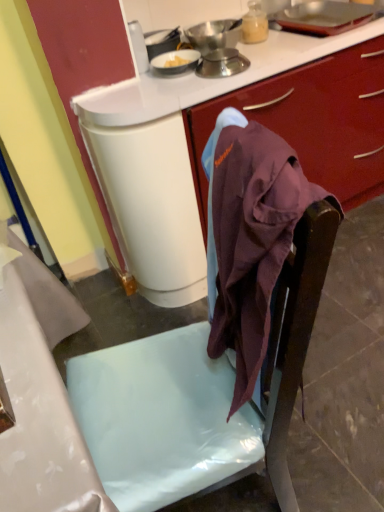
Measure the distance between matte plastic chair at center and camera.

A distance of 22.28 inches exists between matte plastic chair at center and camera.

Image resolution: width=384 pixels, height=512 pixels. Describe the element at coordinates (214, 35) in the screenshot. I see `metallic silver bowl at upper center, which is counted as the first kitchen appliance, starting from the top` at that location.

Identify the location of purple fabric at center. The image size is (384, 512). (172, 159).

Considering the relative sizes of metallic silver scale at upper center, the first kitchen appliance from the bottom, and matte plastic chair at center in the image provided, is metallic silver scale at upper center, the first kitchen appliance from the bottom, smaller than matte plastic chair at center?

Yes.

Which is in front, metallic silver scale at upper center, placed as the 2th kitchen appliance when sorted from top to bottom, or matte plastic chair at center?

matte plastic chair at center is closer to the camera.

In terms of height, does metallic silver scale at upper center, the first kitchen appliance from the bottom, look taller or shorter compared to matte plastic chair at center?

Considering their sizes, metallic silver scale at upper center, the first kitchen appliance from the bottom, has more height than matte plastic chair at center.

Between metallic silver bowl at upper center, which is counted as the first kitchen appliance, starting from the top, and matte plastic chair at center, which one has smaller size?

metallic silver bowl at upper center, which is counted as the first kitchen appliance, starting from the top.

How much distance is there between metallic silver bowl at upper center, which is counted as the first kitchen appliance, starting from the top, and matte plastic chair at center?

They are 3.78 feet apart.

Is metallic silver bowl at upper center, the second kitchen appliance positioned from the bottom, spatially inside matte plastic chair at center, or outside of it?

metallic silver bowl at upper center, the second kitchen appliance positioned from the bottom, is spatially situated outside matte plastic chair at center.

Can you confirm if metallic silver bowl at upper center, which is counted as the first kitchen appliance, starting from the top, is positioned to the right of matte plastic chair at center?

In fact, metallic silver bowl at upper center, which is counted as the first kitchen appliance, starting from the top, is to the left of matte plastic chair at center.

Considering the positions of points (170, 348) and (131, 184), is point (170, 348) closer to camera compared to point (131, 184)?

Yes, point (170, 348) is in front of point (131, 184).

Does matte plastic chair at center appear on the left side of purple fabric at center?

Yes, matte plastic chair at center is to the left of purple fabric at center.

Is matte plastic chair at center not close to purple fabric at center?

matte plastic chair at center is actually quite close to purple fabric at center.

From a real-world perspective, is matte plastic chair at center under metallic silver bowl at upper center, the second kitchen appliance positioned from the bottom?

Correct, in the physical world, matte plastic chair at center is lower than metallic silver bowl at upper center, the second kitchen appliance positioned from the bottom.

From the image's perspective, who appears lower, matte plastic chair at center or metallic silver bowl at upper center, the second kitchen appliance positioned from the bottom?

matte plastic chair at center is shown below in the image.

Identify the location of chair below the metallic silver bowl at upper center, the second kitchen appliance positioned from the bottom (from a real-world perspective). (199, 396).

In the scene shown: Does matte plastic chair at center touch metallic silver bowl at upper center, which is counted as the first kitchen appliance, starting from the top?

There is a gap between matte plastic chair at center and metallic silver bowl at upper center, which is counted as the first kitchen appliance, starting from the top.

Which of these two, matte plastic chair at center or metallic silver scale at upper center, placed as the 2th kitchen appliance when sorted from top to bottom, is smaller?

metallic silver scale at upper center, placed as the 2th kitchen appliance when sorted from top to bottom, is smaller.

The width and height of the screenshot is (384, 512). In order to click on chair below the metallic silver scale at upper center, the first kitchen appliance from the bottom (from a real-world perspective) in this screenshot , I will do `click(199, 396)`.

From a real-world perspective, is matte plastic chair at center positioned over metallic silver scale at upper center, the first kitchen appliance from the bottom, based on gravity?

No.

Does point (198, 337) come farther from viewer compared to point (207, 74)?

No, (198, 337) is closer to viewer.

Is point (239, 72) closer or farther from the camera than point (182, 203)?

Point (239, 72) appears to be closer to the viewer than point (182, 203).

From the image's perspective, which one is positioned lower, metallic silver scale at upper center, the first kitchen appliance from the bottom, or purple fabric at center?

purple fabric at center.

Does metallic silver scale at upper center, placed as the 2th kitchen appliance when sorted from top to bottom, appear on the right side of purple fabric at center?

No, metallic silver scale at upper center, placed as the 2th kitchen appliance when sorted from top to bottom, is not to the right of purple fabric at center.

Looking at their sizes, would you say metallic silver scale at upper center, the first kitchen appliance from the bottom, is wider or thinner than purple fabric at center?

metallic silver scale at upper center, the first kitchen appliance from the bottom, is thinner than purple fabric at center.

Is there a large distance between metallic silver bowl at upper center, which is counted as the first kitchen appliance, starting from the top, and purple fabric at center?

No.

From the purple fabric at center, count 2nd kitchen appliances backward and point to it. Please provide its 2D coordinates.

[(214, 35)]

Is metallic silver bowl at upper center, which is counted as the first kitchen appliance, starting from the top, inside or outside of purple fabric at center?

metallic silver bowl at upper center, which is counted as the first kitchen appliance, starting from the top, cannot be found inside purple fabric at center.

Could you tell me if metallic silver bowl at upper center, the second kitchen appliance positioned from the bottom, is facing purple fabric at center?

No, metallic silver bowl at upper center, the second kitchen appliance positioned from the bottom, does not turn towards purple fabric at center.

Where is `chair below the metallic silver scale at upper center, the first kitchen appliance from the bottom (from the image's perspective)`? This screenshot has height=512, width=384. chair below the metallic silver scale at upper center, the first kitchen appliance from the bottom (from the image's perspective) is located at coordinates (199, 396).

From a real-world perspective, which kitchen appliance is the 2nd one above the matte plastic chair at center? Please provide its 2D coordinates.

[(214, 35)]

From the image, which object appears to be nearer to metallic silver bowl at upper center, the second kitchen appliance positioned from the bottom, purple fabric at center or metallic silver scale at upper center, the first kitchen appliance from the bottom?

Based on the image, metallic silver scale at upper center, the first kitchen appliance from the bottom, appears to be nearer to metallic silver bowl at upper center, the second kitchen appliance positioned from the bottom.

From the image, which object appears to be nearer to purple fabric at center, metallic silver scale at upper center, placed as the 2th kitchen appliance when sorted from top to bottom, or metallic silver bowl at upper center, the second kitchen appliance positioned from the bottom?

metallic silver scale at upper center, placed as the 2th kitchen appliance when sorted from top to bottom.

Which object lies nearer to the anchor point metallic silver bowl at upper center, which is counted as the first kitchen appliance, starting from the top, matte plastic chair at center or purple fabric at center?

purple fabric at center is closer to metallic silver bowl at upper center, which is counted as the first kitchen appliance, starting from the top.

Considering their positions, is matte plastic chair at center positioned closer to metallic silver scale at upper center, the first kitchen appliance from the bottom, than metallic silver bowl at upper center, which is counted as the first kitchen appliance, starting from the top?

metallic silver bowl at upper center, which is counted as the first kitchen appliance, starting from the top.

Which object lies further to the anchor point purple fabric at center, metallic silver bowl at upper center, which is counted as the first kitchen appliance, starting from the top, or matte plastic chair at center?

matte plastic chair at center is positioned further to the anchor purple fabric at center.

Looking at this image, looking at the image, which one is located closer to matte plastic chair at center, purple fabric at center or metallic silver scale at upper center, the first kitchen appliance from the bottom?

purple fabric at center is closer to matte plastic chair at center.

Considering their positions, is metallic silver scale at upper center, placed as the 2th kitchen appliance when sorted from top to bottom, positioned closer to metallic silver bowl at upper center, which is counted as the first kitchen appliance, starting from the top, than matte plastic chair at center?

Among the two, metallic silver scale at upper center, placed as the 2th kitchen appliance when sorted from top to bottom, is located nearer to metallic silver bowl at upper center, which is counted as the first kitchen appliance, starting from the top.

Which object lies further to the anchor point metallic silver bowl at upper center, which is counted as the first kitchen appliance, starting from the top, metallic silver scale at upper center, the first kitchen appliance from the bottom, or purple fabric at center?

purple fabric at center is positioned further to the anchor metallic silver bowl at upper center, which is counted as the first kitchen appliance, starting from the top.

Find the location of a particular element. Image resolution: width=384 pixels, height=512 pixels. kitchen appliance between metallic silver bowl at upper center, the second kitchen appliance positioned from the bottom, and matte plastic chair at center, in the vertical direction is located at coordinates (222, 63).

You are a GUI agent. You are given a task and a screenshot of the screen. Output one action in this format:
    pyautogui.click(x=<x>, y=<y>)
    Task: Click on the kitchen appliance located between metallic silver bowl at upper center, which is counted as the first kitchen appliance, starting from the top, and purple fabric at center in the left-right direction
    This screenshot has width=384, height=512.
    Given the screenshot: What is the action you would take?
    pyautogui.click(x=222, y=63)

Image resolution: width=384 pixels, height=512 pixels. Find the location of `desk between metallic silver scale at upper center, the first kitchen appliance from the bottom, and matte plastic chair at center, in the vertical direction`. desk between metallic silver scale at upper center, the first kitchen appliance from the bottom, and matte plastic chair at center, in the vertical direction is located at coordinates (172, 159).

You are a GUI agent. You are given a task and a screenshot of the screen. Output one action in this format:
    pyautogui.click(x=<x>, y=<y>)
    Task: Click on the desk between metallic silver bowl at upper center, which is counted as the first kitchen appliance, starting from the top, and matte plastic chair at center vertically
    
    Given the screenshot: What is the action you would take?
    pyautogui.click(x=172, y=159)